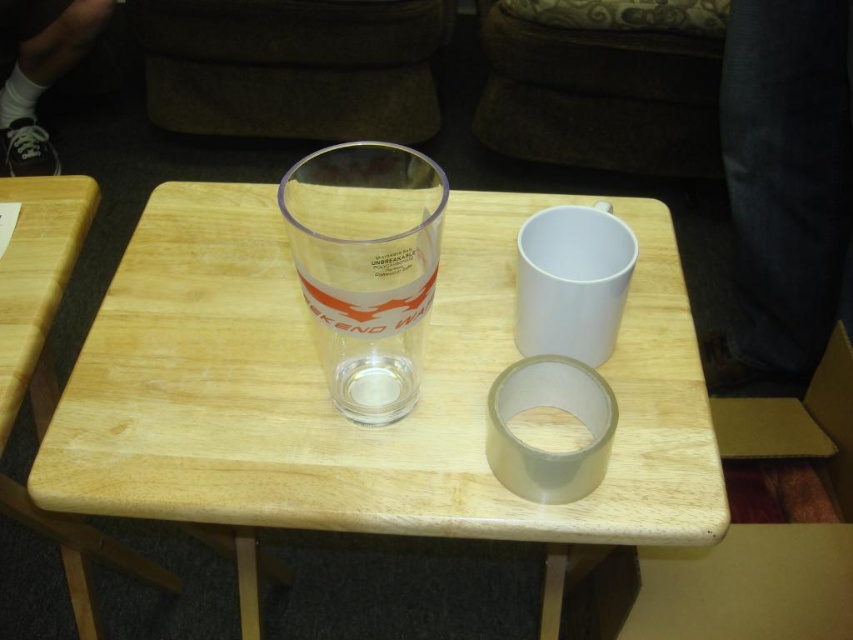
Between clear glass shot glass at center and light wood table at left, which one is positioned higher?

Positioned higher is clear glass shot glass at center.

Is clear glass shot glass at center to the left of light wood table at left from the viewer's perspective?

In fact, clear glass shot glass at center is to the right of light wood table at left.

Between point (402, 157) and point (45, 400), which one is positioned in front?

Positioned in front is point (402, 157).

You are a GUI agent. You are given a task and a screenshot of the screen. Output one action in this format:
    pyautogui.click(x=<x>, y=<y>)
    Task: Click on the clear glass shot glass at center
    
    Given the screenshot: What is the action you would take?
    pyautogui.click(x=366, y=266)

Is transparent plastic cup at center wider than light wood table at left?

Yes.

Is point (666, 336) farther from viewer compared to point (39, 195)?

No, (666, 336) is closer to viewer.

Which is in front, point (149, 337) or point (33, 413)?

Positioned in front is point (149, 337).

You are a GUI agent. You are given a task and a screenshot of the screen. Output one action in this format:
    pyautogui.click(x=<x>, y=<y>)
    Task: Click on the transparent plastic cup at center
    The image size is (853, 640).
    Given the screenshot: What is the action you would take?
    pyautogui.click(x=344, y=419)

Does transparent plastic cup at center lie behind clear glass shot glass at center?

That is True.

In the scene shown: Can you confirm if transparent plastic cup at center is shorter than clear glass shot glass at center?

Incorrect, transparent plastic cup at center's height does not fall short of clear glass shot glass at center's.

Which is behind, point (233, 237) or point (370, 385)?

Point (233, 237)

Where is `transparent plastic cup at center`? The width and height of the screenshot is (853, 640). transparent plastic cup at center is located at coordinates (344, 419).